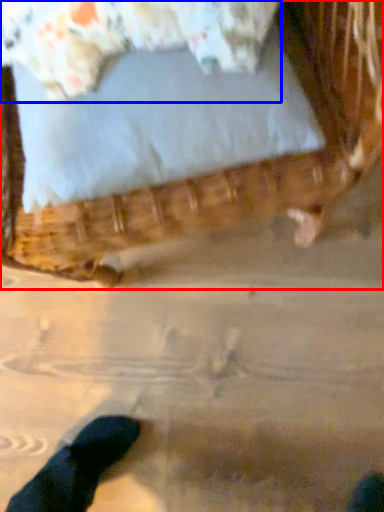
Question: Which object appears closest to the camera in this image, furniture (highlighted by a red box) or pillow (highlighted by a blue box)?

Choices:
 (A) furniture
 (B) pillow

Answer: (A)